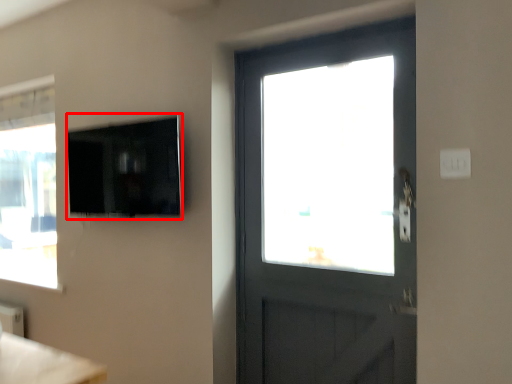
Question: Considering the relative positions of window screen (annotated by the red box) and light switch in the image provided, where is window screen (annotated by the red box) located with respect to the staircase?

Choices:
 (A) right
 (B) left

Answer: (B)